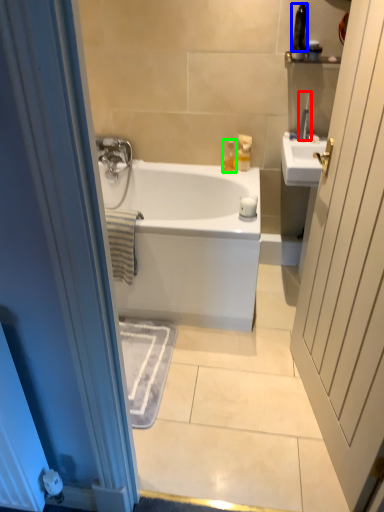
Question: Based on their relative distances, which object is farther from toiletry (highlighted by a red box)? Choose from toiletry (highlighted by a blue box) and toiletry (highlighted by a green box).

Choices:
 (A) toiletry
 (B) toiletry

Answer: (B)